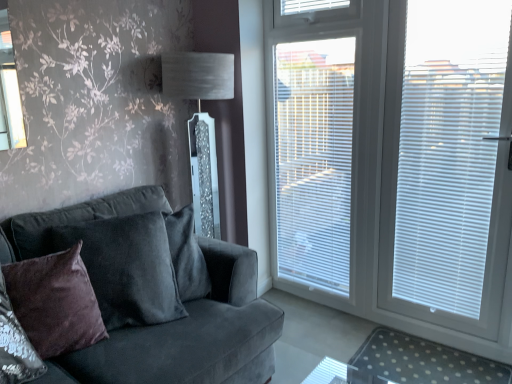
Question: Does point (438, 81) appear closer or farther from the camera than point (215, 296)?

Choices:
 (A) closer
 (B) farther

Answer: (B)

Question: Considering the positions of white plastic blinds at right, positioned as the third blind in left-to-right order, and velvet dark gray couch at left in the image, is white plastic blinds at right, positioned as the third blind in left-to-right order, bigger or smaller than velvet dark gray couch at left?

Choices:
 (A) small
 (B) big

Answer: (A)

Question: Based on their relative distances, which object is nearer to the white plastic blinds at right, which is counted as the 2th blind, starting from the left?

Choices:
 (A) white plastic blinds at upper center, which ranks as the first blind in left-to-right order
 (B) white plastic blinds at right, positioned as the third blind in left-to-right order
 (C) velvet dark gray couch at left
 (D) clear polka dot mat at lower right
 (E) velvet brown pillow at left

Answer: (B)

Question: Which object is the farthest from the velvet dark gray couch at left?

Choices:
 (A) velvet brown pillow at left
 (B) white blinds at right
 (C) white plastic blinds at right, positioned as the third blind in left-to-right order
 (D) white plastic blinds at upper center, which ranks as the first blind in left-to-right order
 (E) clear polka dot mat at lower right

Answer: (D)